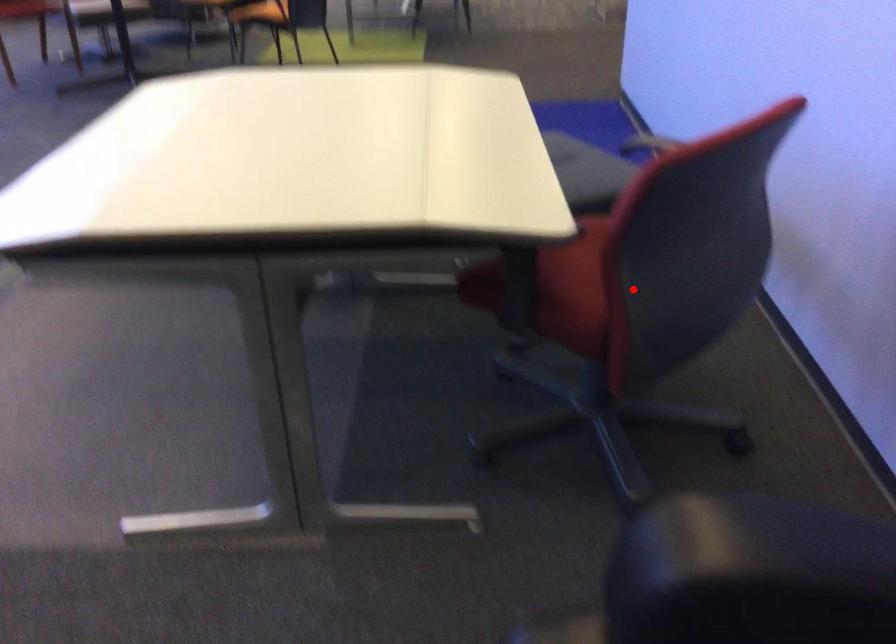
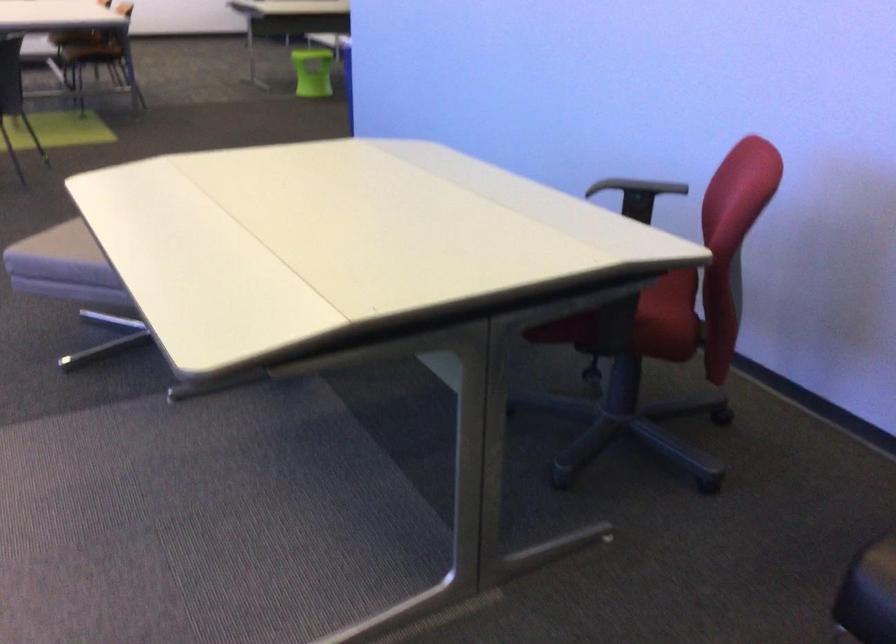
Question: I am providing you with two images of the same scene from different viewpoints. Given a red point in image1, look at the same physical point in image2. Is it:

Choices:
 (A) Closer to the viewpoint
 (B) Farther from the viewpoint

Answer: (B)